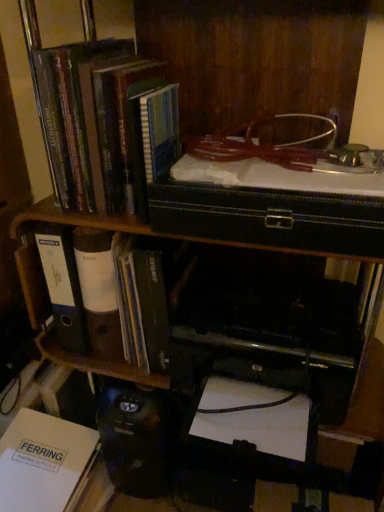
Question: Considering the positions of point (34, 431) and point (150, 298), is point (34, 431) closer or farther from the camera than point (150, 298)?

Choices:
 (A) closer
 (B) farther

Answer: (B)

Question: Is white paper at lower left, positioned as the 3th book in top-to-bottom order, bigger or smaller than white paper folder at left, positioned as the 2th book in bottom-to-top order?

Choices:
 (A) small
 (B) big

Answer: (B)

Question: Considering the real-world distances, which object is closest to the hardcover book at upper left, the third book ordered from the bottom?

Choices:
 (A) white paper folder at left, positioned as the 2th book in bottom-to-top order
 (B) white paper at lower left, placed as the 1th book when sorted from bottom to top
 (C) black plastic printer at lower center

Answer: (A)

Question: Which is nearer to the white paper folder at left, the 2th book in the top-to-bottom sequence?

Choices:
 (A) white paper at lower left, placed as the 1th book when sorted from bottom to top
 (B) black plastic printer at lower center
 (C) hardcover book at upper left, the third book ordered from the bottom

Answer: (B)